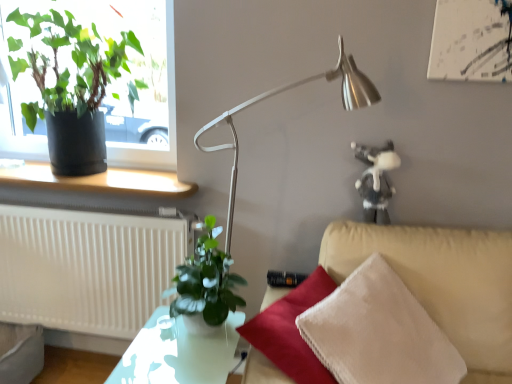
Question: From the image's perspective, is satin silver lamp at center on top of white textured radiator at lower left?

Choices:
 (A) no
 (B) yes

Answer: (B)

Question: Can you confirm if satin silver lamp at center is bigger than white textured radiator at lower left?

Choices:
 (A) no
 (B) yes

Answer: (B)

Question: Considering the relative positions of satin silver lamp at center and white textured radiator at lower left in the image provided, is satin silver lamp at center to the left of white textured radiator at lower left from the viewer's perspective?

Choices:
 (A) no
 (B) yes

Answer: (A)

Question: From the image's perspective, does satin silver lamp at center appear lower than white textured radiator at lower left?

Choices:
 (A) yes
 (B) no

Answer: (B)

Question: Does satin silver lamp at center contain white textured radiator at lower left?

Choices:
 (A) no
 (B) yes

Answer: (A)

Question: Visually, is green matte plant at upper left, which ranks as the second houseplant in bottom-to-top order, positioned to the left or to the right of white textured radiator at lower left?

Choices:
 (A) right
 (B) left

Answer: (B)

Question: From a real-world perspective, is green matte plant at upper left, the second houseplant in the right-to-left sequence, positioned above or below white textured radiator at lower left?

Choices:
 (A) below
 (B) above

Answer: (B)

Question: Is green matte plant at upper left, the second houseplant in the right-to-left sequence, inside or outside of white textured radiator at lower left?

Choices:
 (A) outside
 (B) inside

Answer: (A)

Question: In the image, is green matte plant at upper left, which ranks as the second houseplant in bottom-to-top order, positioned in front of or behind white textured radiator at lower left?

Choices:
 (A) front
 (B) behind

Answer: (A)

Question: Is green matte plant at center, which is counted as the 1th houseplant, starting from the bottom, inside or outside of green matte plant at upper left, the second houseplant in the right-to-left sequence?

Choices:
 (A) inside
 (B) outside

Answer: (B)

Question: From a real-world perspective, is green matte plant at center, which appears as the second houseplant when viewed from the left, above or below green matte plant at upper left, marked as the first houseplant in a back-to-front arrangement?

Choices:
 (A) below
 (B) above

Answer: (A)

Question: In the image, is green matte plant at center, which appears as the second houseplant when viewed from the left, positioned in front of or behind green matte plant at upper left, positioned as the 2th houseplant in front-to-back order?

Choices:
 (A) behind
 (B) front

Answer: (B)

Question: Based on their positions, is green matte plant at center, which is counted as the 1th houseplant, starting from the bottom, located to the left or right of green matte plant at upper left, which ranks as the second houseplant in bottom-to-top order?

Choices:
 (A) left
 (B) right

Answer: (B)

Question: From a real-world perspective, is green matte plant at center, the second houseplant viewed from the top, positioned above or below matte black window sill at lower left?

Choices:
 (A) above
 (B) below

Answer: (B)

Question: Considering the positions of point (214, 294) and point (65, 188), is point (214, 294) closer or farther from the camera than point (65, 188)?

Choices:
 (A) farther
 (B) closer

Answer: (B)